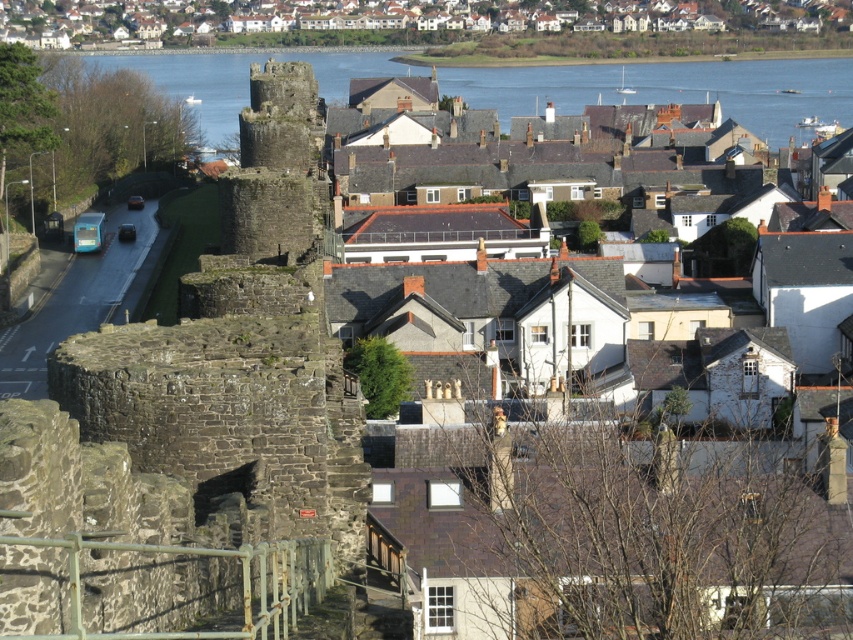
You are an architect analyzing the layout of this historic town. Based on the scene, which object occupies more horizontal space in the image between the white textured houses at upper center and the clear blue water at upper center?

The white textured houses at upper center occupy more horizontal space than the clear blue water at upper center because their width is larger according to the description.